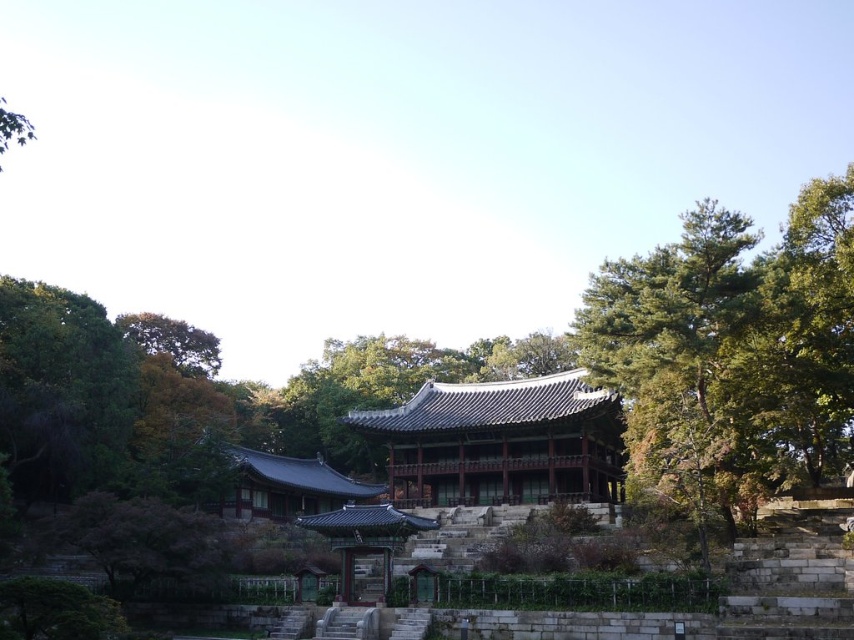
Question: Estimate the real-world distances between objects in this image. Which object is farther from the shiny dark brown wooden temple at center?

Choices:
 (A) green textured tree at right
 (B) green leafy tree at upper left

Answer: (B)

Question: Can you confirm if green textured tree at right is positioned to the left of green leafy tree at upper left?

Choices:
 (A) no
 (B) yes

Answer: (A)

Question: Estimate the real-world distances between objects in this image. Which object is farther from the green leafy tree at upper left?

Choices:
 (A) shiny dark brown wooden temple at center
 (B) green textured tree at right

Answer: (B)

Question: Which point is closer to the camera?

Choices:
 (A) (642, 470)
 (B) (611, 404)

Answer: (A)

Question: Can you confirm if green textured tree at right is positioned to the left of green leafy tree at upper left?

Choices:
 (A) no
 (B) yes

Answer: (A)

Question: Does green textured tree at right have a larger size compared to shiny dark brown wooden temple at center?

Choices:
 (A) yes
 (B) no

Answer: (A)